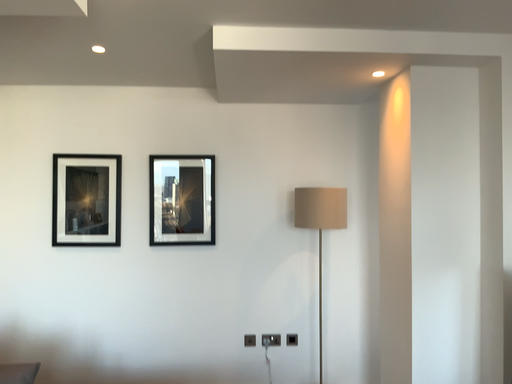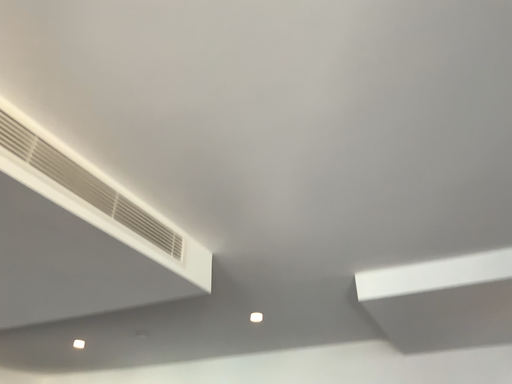
Question: How did the camera likely rotate when shooting the video?

Choices:
 (A) rotated upward
 (B) rotated downward

Answer: (A)